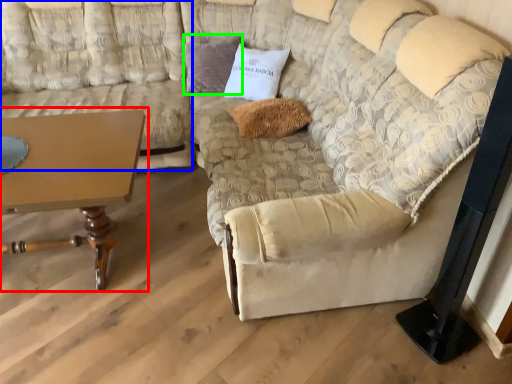
Question: Which object is positioned closest to table (highlighted by a red box)? Select from couch (highlighted by a blue box) and pillow (highlighted by a green box).

Choices:
 (A) couch
 (B) pillow

Answer: (A)